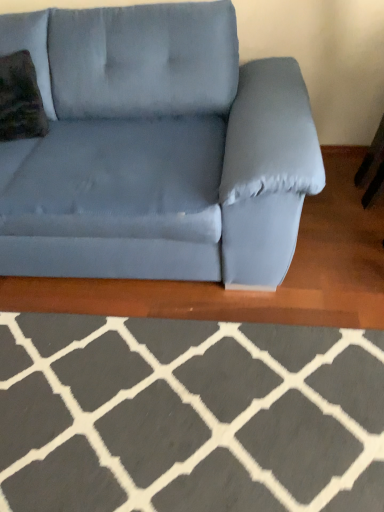
Question: Does suede blue couch at center have a lesser height compared to velvety green throw pillow at upper left?

Choices:
 (A) yes
 (B) no

Answer: (B)

Question: Can you see suede blue couch at center touching velvety green throw pillow at upper left?

Choices:
 (A) no
 (B) yes

Answer: (A)

Question: Could velvety green throw pillow at upper left be considered to be inside suede blue couch at center?

Choices:
 (A) yes
 (B) no

Answer: (A)

Question: Does suede blue couch at center lie in front of velvety green throw pillow at upper left?

Choices:
 (A) no
 (B) yes

Answer: (B)

Question: Considering the relative sizes of suede blue couch at center and velvety green throw pillow at upper left in the image provided, is suede blue couch at center smaller than velvety green throw pillow at upper left?

Choices:
 (A) no
 (B) yes

Answer: (A)

Question: Is suede blue couch at center not inside velvety green throw pillow at upper left?

Choices:
 (A) yes
 (B) no

Answer: (A)

Question: Considering the relative sizes of velvety green throw pillow at upper left and suede blue couch at center in the image provided, is velvety green throw pillow at upper left wider than suede blue couch at center?

Choices:
 (A) no
 (B) yes

Answer: (A)

Question: Is velvety green throw pillow at upper left at the right side of suede blue couch at center?

Choices:
 (A) no
 (B) yes

Answer: (A)

Question: From a real-world perspective, is velvety green throw pillow at upper left physically below suede blue couch at center?

Choices:
 (A) no
 (B) yes

Answer: (A)

Question: Can you confirm if velvety green throw pillow at upper left is shorter than suede blue couch at center?

Choices:
 (A) yes
 (B) no

Answer: (A)

Question: Considering the relative sizes of velvety green throw pillow at upper left and suede blue couch at center in the image provided, is velvety green throw pillow at upper left taller than suede blue couch at center?

Choices:
 (A) yes
 (B) no

Answer: (B)

Question: Does velvety green throw pillow at upper left have a lesser width compared to suede blue couch at center?

Choices:
 (A) yes
 (B) no

Answer: (A)

Question: From the image's perspective, does gray wool rug at lower center appear higher than velvety green throw pillow at upper left?

Choices:
 (A) no
 (B) yes

Answer: (A)